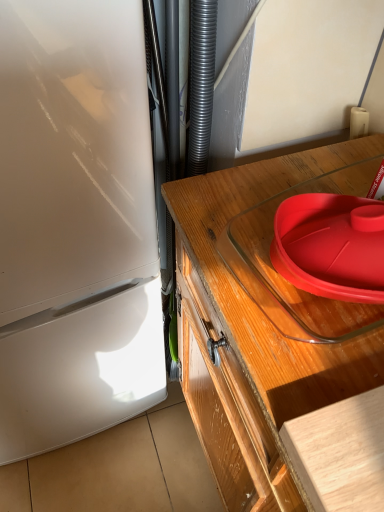
You are a GUI agent. You are given a task and a screenshot of the screen. Output one action in this format:
    pyautogui.click(x=<x>, y=<y>)
    Task: Click on the transparent glass tray at upper right
    The image size is (384, 512).
    Given the screenshot: What is the action you would take?
    pyautogui.click(x=251, y=300)

Describe the element at coordinates (251, 300) in the screenshot. Image resolution: width=384 pixels, height=512 pixels. I see `transparent glass tray at upper right` at that location.

This screenshot has width=384, height=512. Describe the element at coordinates (331, 246) in the screenshot. I see `red plastic lid at upper right` at that location.

Where is `red plastic lid at upper right`? The width and height of the screenshot is (384, 512). red plastic lid at upper right is located at coordinates (331, 246).

Find the location of a particular element. The width and height of the screenshot is (384, 512). transparent glass tray at upper right is located at coordinates (251, 300).

Visually, is transparent glass tray at upper right positioned to the left or to the right of red plastic lid at upper right?

transparent glass tray at upper right is to the left of red plastic lid at upper right.

Between transparent glass tray at upper right and red plastic lid at upper right, which one is positioned behind?

red plastic lid at upper right is more distant.

Which point is more forward, (275, 337) or (380, 287)?

The point (380, 287) is closer to the camera.

From the image's perspective, relative to red plastic lid at upper right, is transparent glass tray at upper right above or below?

From the image's perspective, transparent glass tray at upper right appears below red plastic lid at upper right.

From a real-world perspective, is transparent glass tray at upper right positioned under red plastic lid at upper right based on gravity?

Yes, from a real-world perspective, transparent glass tray at upper right is beneath red plastic lid at upper right.

Which object is thinner, transparent glass tray at upper right or red plastic lid at upper right?

red plastic lid at upper right.

Who is taller, transparent glass tray at upper right or red plastic lid at upper right?

transparent glass tray at upper right.

Considering the sizes of transparent glass tray at upper right and red plastic lid at upper right in the image, is transparent glass tray at upper right bigger or smaller than red plastic lid at upper right?

Clearly, transparent glass tray at upper right is larger in size than red plastic lid at upper right.

Would you say transparent glass tray at upper right is outside red plastic lid at upper right?

Absolutely, transparent glass tray at upper right is external to red plastic lid at upper right.

Is transparent glass tray at upper right directly adjacent to red plastic lid at upper right?

No, transparent glass tray at upper right is not making contact with red plastic lid at upper right.

Is transparent glass tray at upper right oriented away from red plastic lid at upper right?

No, transparent glass tray at upper right's orientation is not away from red plastic lid at upper right.

How many degrees apart are the facing directions of transparent glass tray at upper right and red plastic lid at upper right?

They differ by 10.7 degrees in their facing directions.

How far apart are transparent glass tray at upper right and red plastic lid at upper right?

transparent glass tray at upper right and red plastic lid at upper right are 4.16 inches apart.

Find the location of a particular element. countertop that is in front of the red plastic lid at upper right is located at coordinates (251, 300).

Considering the relative positions of red plastic lid at upper right and transparent glass tray at upper right in the image provided, is red plastic lid at upper right to the right of transparent glass tray at upper right from the viewer's perspective?

Yes, red plastic lid at upper right is to the right of transparent glass tray at upper right.

Is red plastic lid at upper right positioned in front of transparent glass tray at upper right?

No, the depth of red plastic lid at upper right is greater than that of transparent glass tray at upper right.

Is point (287, 251) farther from camera compared to point (241, 333)?

Yes, it is behind point (241, 333).

From the image's perspective, would you say red plastic lid at upper right is positioned over transparent glass tray at upper right?

Indeed, from the image's perspective, red plastic lid at upper right is shown above transparent glass tray at upper right.

From a real-world perspective, is red plastic lid at upper right on transparent glass tray at upper right?

Yes, from a real-world perspective, red plastic lid at upper right is on top of transparent glass tray at upper right.

Between red plastic lid at upper right and transparent glass tray at upper right, which one has smaller width?

red plastic lid at upper right is thinner.

Considering the sizes of objects red plastic lid at upper right and transparent glass tray at upper right in the image provided, who is taller, red plastic lid at upper right or transparent glass tray at upper right?

Standing taller between the two is transparent glass tray at upper right.

Can you confirm if red plastic lid at upper right is bigger than transparent glass tray at upper right?

Actually, red plastic lid at upper right might be smaller than transparent glass tray at upper right.

Can we say red plastic lid at upper right lies outside transparent glass tray at upper right?

No, red plastic lid at upper right is inside or overlapping with transparent glass tray at upper right.

Is red plastic lid at upper right far away from transparent glass tray at upper right?

No, red plastic lid at upper right is in close proximity to transparent glass tray at upper right.

Is red plastic lid at upper right oriented away from transparent glass tray at upper right?

No, red plastic lid at upper right is not facing the opposite direction of transparent glass tray at upper right.

What's the angular difference between red plastic lid at upper right and transparent glass tray at upper right's facing directions?

10.7 degrees separate the facing orientations of red plastic lid at upper right and transparent glass tray at upper right.

How much distance is there between red plastic lid at upper right and transparent glass tray at upper right?

They are 4.16 inches apart.

Locate an element on the screen. The height and width of the screenshot is (512, 384). plate located behind the transparent glass tray at upper right is located at coordinates (331, 246).

Find the location of a particular element. The width and height of the screenshot is (384, 512). countertop beneath the red plastic lid at upper right (from a real-world perspective) is located at coordinates (251, 300).

I want to click on plate above the transparent glass tray at upper right (from the image's perspective), so click(x=331, y=246).